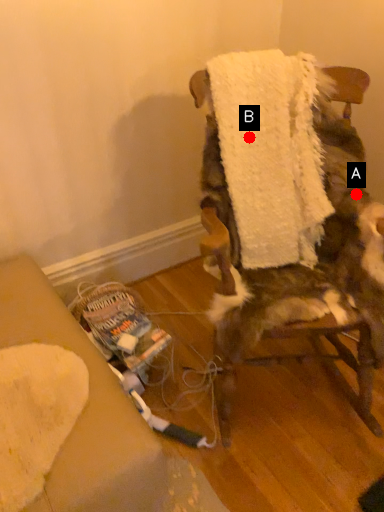
Question: Two points are circled on the image, labeled by A and B beside each circle. Which of the following is the farthest from the observer?

Choices:
 (A) A is further
 (B) B is further

Answer: (A)